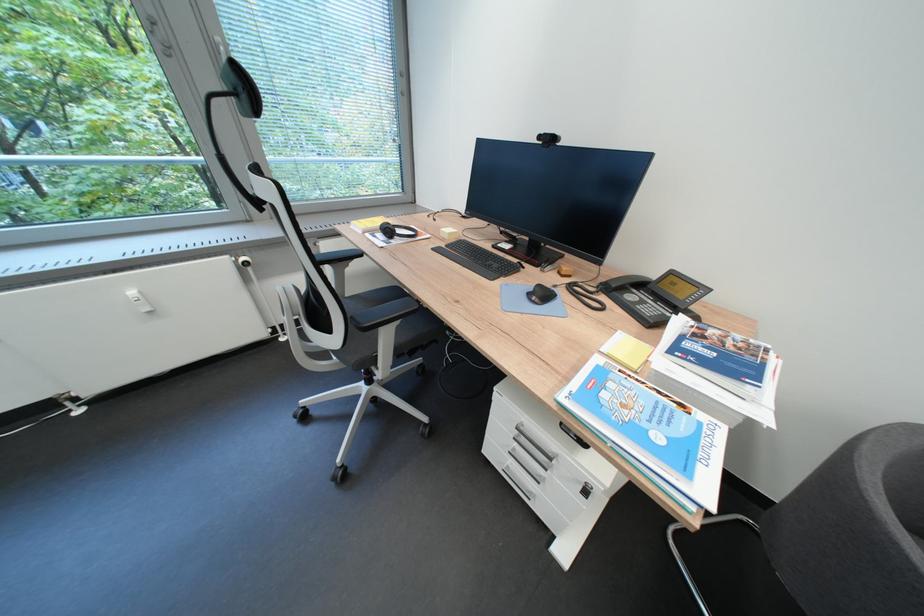
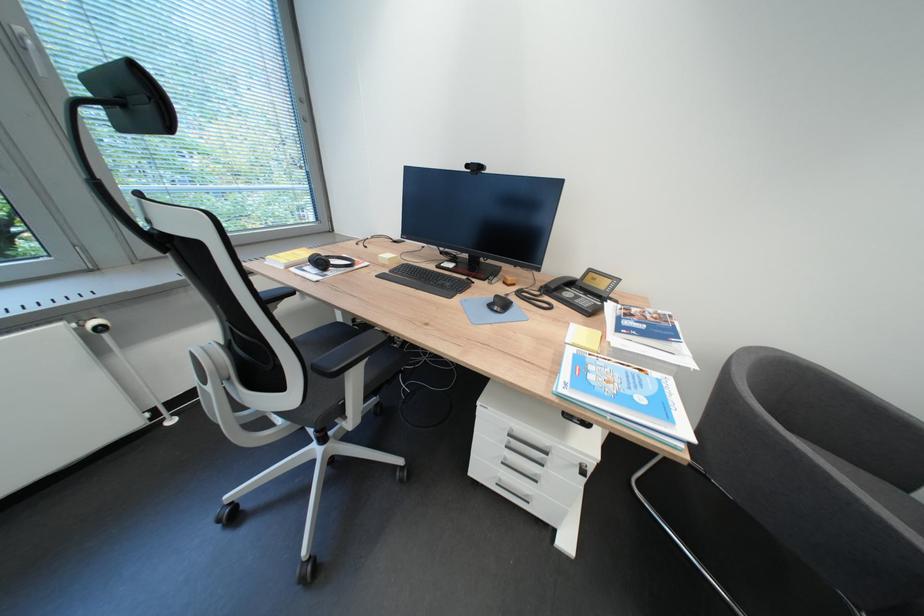
Where in the second image is the point corresponding to [367,249] from the first image?

(292, 286)